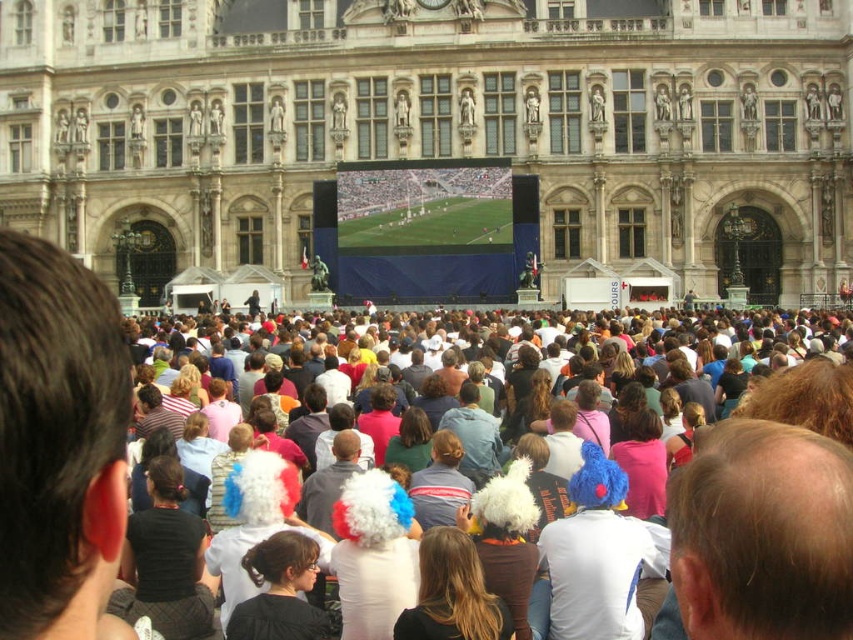
Question: Is white fluffy wigs at center to the right of green grass field at center from the viewer's perspective?

Choices:
 (A) yes
 (B) no

Answer: (A)

Question: Which of these objects is positioned farthest from the stone facade building at center?

Choices:
 (A) white fluffy wigs at center
 (B) green grass field at center

Answer: (A)

Question: Which of the following is the farthest from the observer?

Choices:
 (A) green grass field at center
 (B) stone facade building at center
 (C) white fluffy wigs at center

Answer: (A)

Question: Which of the following is the closest to the observer?

Choices:
 (A) white fluffy wigs at center
 (B) green grass field at center

Answer: (A)

Question: Is white fluffy wigs at center closer to camera compared to green grass field at center?

Choices:
 (A) yes
 (B) no

Answer: (A)

Question: Can you confirm if stone facade building at center is positioned below green grass field at center?

Choices:
 (A) yes
 (B) no

Answer: (B)